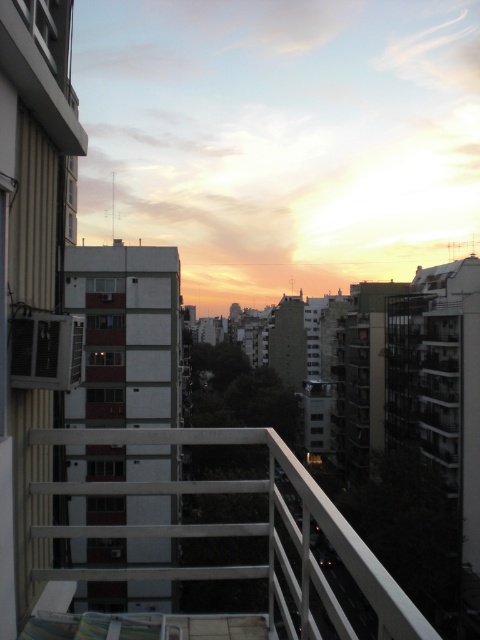
You are standing on a balcony and want to take a photo of the cityscape. If you position your camera to capture the entire scene, where should you aim the camera relative to the white metal railing at center?

You should aim the camera at the white metal railing at center, which is located at point (240, 532), to capture the entire cityscape scene.

You are standing on a balcony and looking at two points in the cityscape. The first point is at coordinates point [260,492] and the second is at point [73,369]. Which point is closer to you?

Point [73,369] is closer to you because it is less further to the camera than point [260,492].